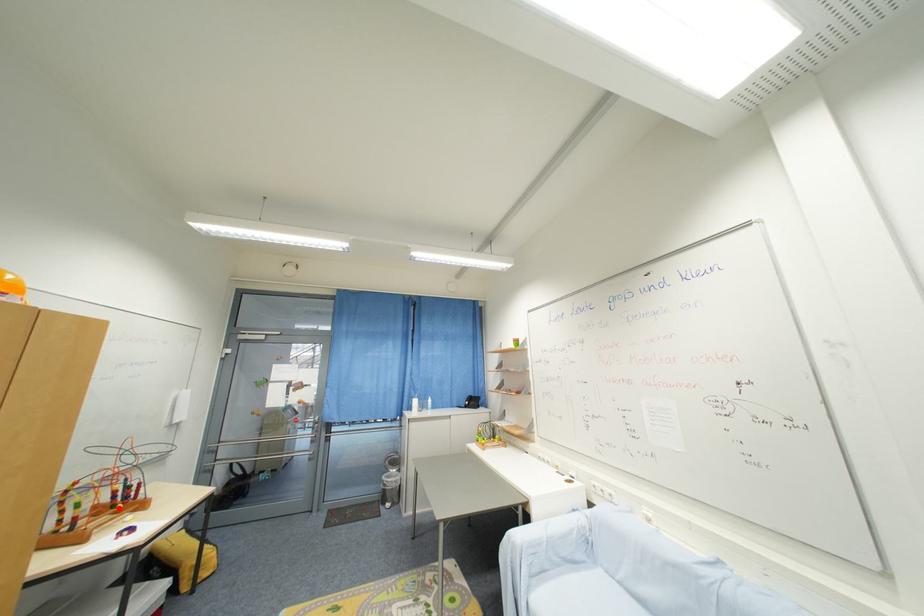
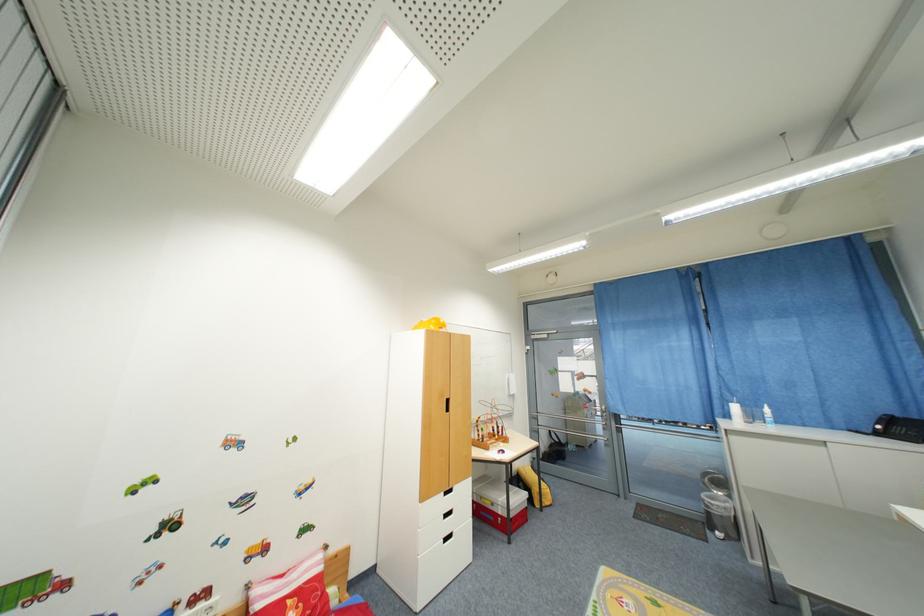
Question: I am providing you with two images of the same scene from different viewpoints. A red point is shown in image1. For the corresponding object point in image2, is it positioned nearer or farther from the camera?

Choices:
 (A) Nearer
 (B) Farther

Answer: (B)